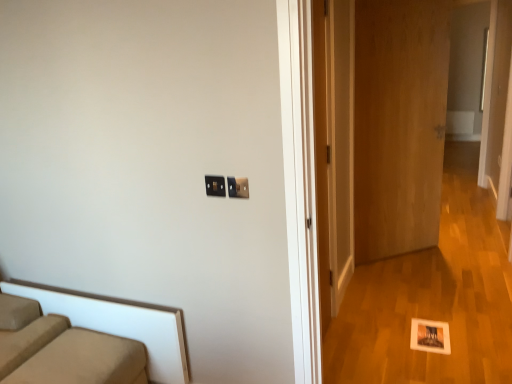
Question: From the image's perspective, is black plastic electric outlet at center, the 1th electric outlet when ordered from left to right, above or below wooden door at center, the 2th door positioned from the left?

Choices:
 (A) above
 (B) below

Answer: (B)

Question: Is black plastic electric outlet at center, the 1th electric outlet when ordered from left to right, taller or shorter than wooden door at center, which appears as the 2th door when viewed from the front?

Choices:
 (A) short
 (B) tall

Answer: (A)

Question: Which object is the closest to the wooden door at center, the 2th door positioned from the left?

Choices:
 (A) black plastic electric outlet at center, the second electric outlet viewed from the right
 (B) beige fabric studio couch at lower left
 (C) matte black switch at upper center, which ranks as the second electric outlet in left-to-right order
 (D) wooden door at right, which is the 1th door in left-to-right order

Answer: (D)

Question: Considering the real-world distances, which object is closest to the black plastic electric outlet at center, the second electric outlet viewed from the right?

Choices:
 (A) wooden door at center, which ranks as the first door in back-to-front order
 (B) matte black switch at upper center, which ranks as the second electric outlet in left-to-right order
 (C) beige fabric studio couch at lower left
 (D) wooden door at right, which is the 1th door in left-to-right order

Answer: (B)